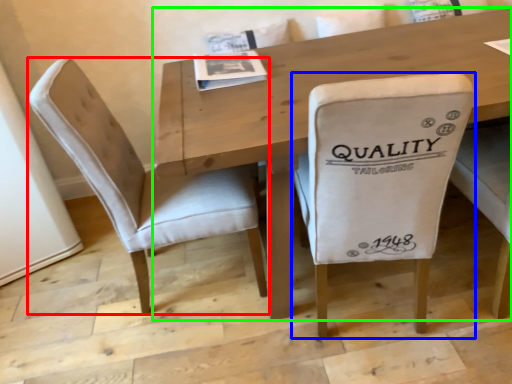
Question: Which is farther away from chair (highlighted by a red box)? chair (highlighted by a blue box) or table (highlighted by a green box)?

Choices:
 (A) chair
 (B) table

Answer: (A)